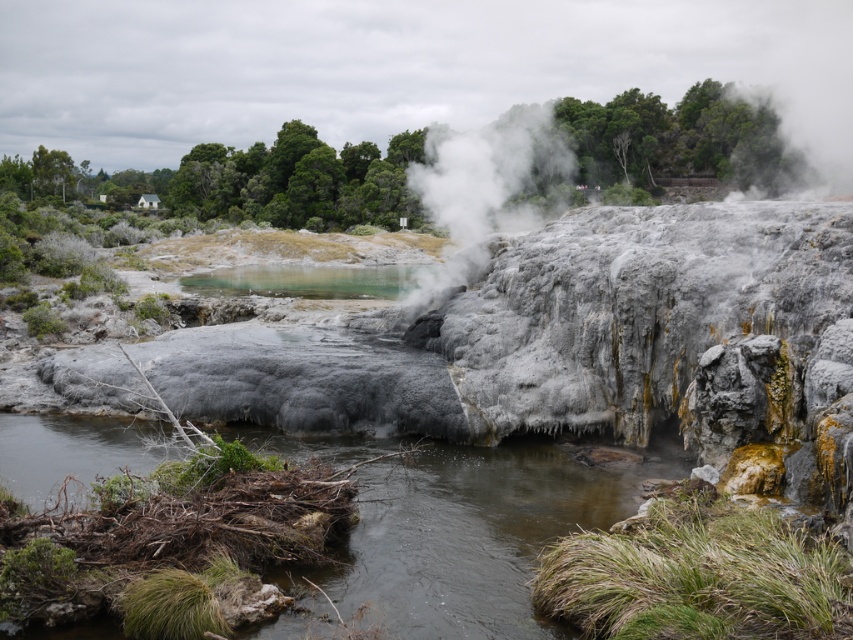
You are a photographer standing in the geothermal landscape and want to capture both the brown wood at center and the white fluffy steam at upper center in your photo. Since you have a limited depth of field, which object will appear more in focus?

The brown wood at center will appear more in focus because it is closer to the viewer than the white fluffy steam at upper center, so with limited depth of field, closer objects are sharper.

You are standing at the point marked as point (465, 536) in a geothermal landscape. What is the surface you are currently standing on?

The point (465, 536) is on brown wood at center, so you are standing on brown wood at center.